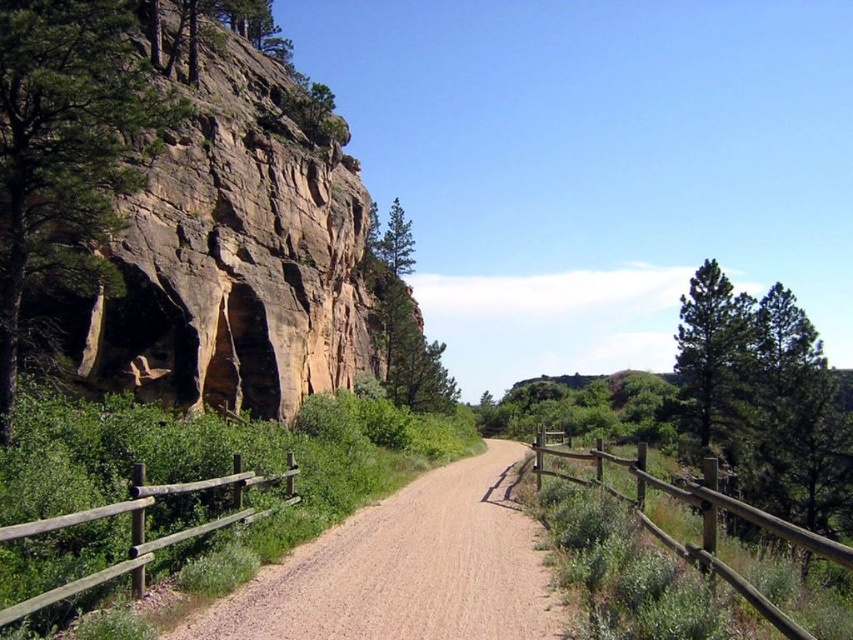
Does green leafy tree at upper left appear under green textured pine tree at center?

No, green leafy tree at upper left is not below green textured pine tree at center.

Does green leafy tree at upper left appear on the right side of green textured pine tree at center?

Incorrect, green leafy tree at upper left is not on the right side of green textured pine tree at center.

The height and width of the screenshot is (640, 853). Describe the element at coordinates (67, 148) in the screenshot. I see `green leafy tree at upper left` at that location.

This screenshot has width=853, height=640. Identify the location of green leafy tree at upper left. (67, 148).

Who is shorter, brown wooden fence at right or brown wooden fence at lower left?

With less height is brown wooden fence at lower left.

Who is lower down, brown wooden fence at right or brown wooden fence at lower left?

Positioned lower is brown wooden fence at right.

Which is behind, point (699, 493) or point (77, 588)?

The point (699, 493) is more distant.

Identify the location of brown wooden fence at right. (700, 516).

Who is positioned more to the right, green matte tree at right or green textured pine tree at center?

From the viewer's perspective, green matte tree at right appears more on the right side.

Between point (717, 275) and point (383, 259), which one is positioned in front?

Positioned in front is point (717, 275).

Which is behind, point (723, 298) or point (395, 316)?

Point (395, 316)

You are a GUI agent. You are given a task and a screenshot of the screen. Output one action in this format:
    pyautogui.click(x=<x>, y=<y>)
    Task: Click on the green matte tree at right
    
    Given the screenshot: What is the action you would take?
    pyautogui.click(x=712, y=356)